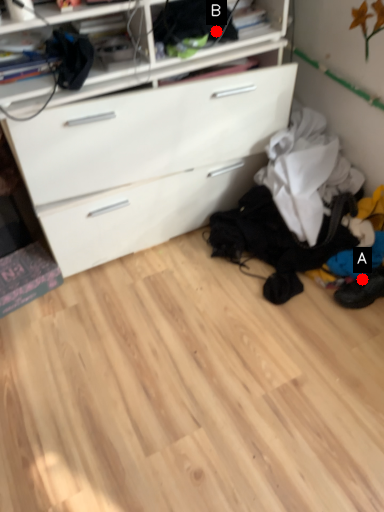
Question: Two points are circled on the image, labeled by A and B beside each circle. Which point appears closest to the camera in this image?

Choices:
 (A) A is closer
 (B) B is closer

Answer: (B)